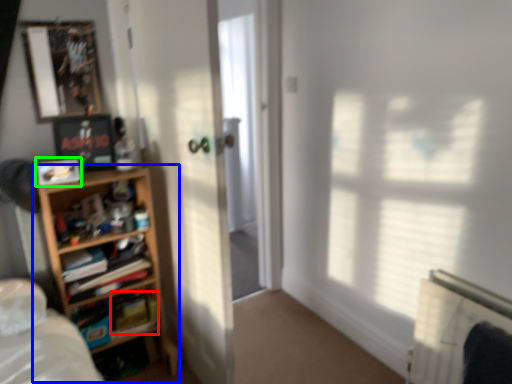
Question: Which is nearer to the paperback book (highlighted by a red box)? shelf (highlighted by a blue box) or picture frame (highlighted by a green box).

Choices:
 (A) shelf
 (B) picture frame

Answer: (A)